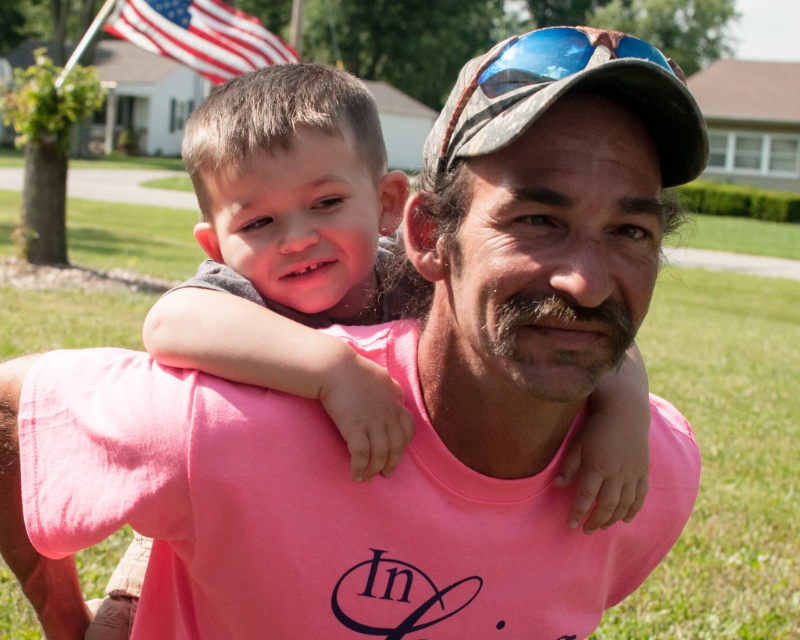
Which is above, camouflage fabric baseball cap at upper center or blue reflective lens at center?

blue reflective lens at center is higher up.

Is point (532, 54) positioned behind point (521, 67)?

No, (532, 54) is in front of (521, 67).

Is point (694, 157) farther from viewer compared to point (509, 81)?

That is True.

The height and width of the screenshot is (640, 800). I want to click on camouflage fabric baseball cap at upper center, so click(566, 92).

Between camouflage fabric baseball cap at upper center and american flag at upper left, which one has more height?

With more height is american flag at upper left.

Is point (525, 109) positioned before point (266, 49)?

Yes, point (525, 109) is in front of point (266, 49).

Identify the location of camouflage fabric baseball cap at upper center. (566, 92).

Is the position of american flag at upper left less distant than that of blue reflective lens at center?

No, it is not.

Can you confirm if american flag at upper left is smaller than blue reflective lens at center?

Actually, american flag at upper left might be larger than blue reflective lens at center.

Locate an element on the screen. Image resolution: width=800 pixels, height=640 pixels. american flag at upper left is located at coordinates (200, 35).